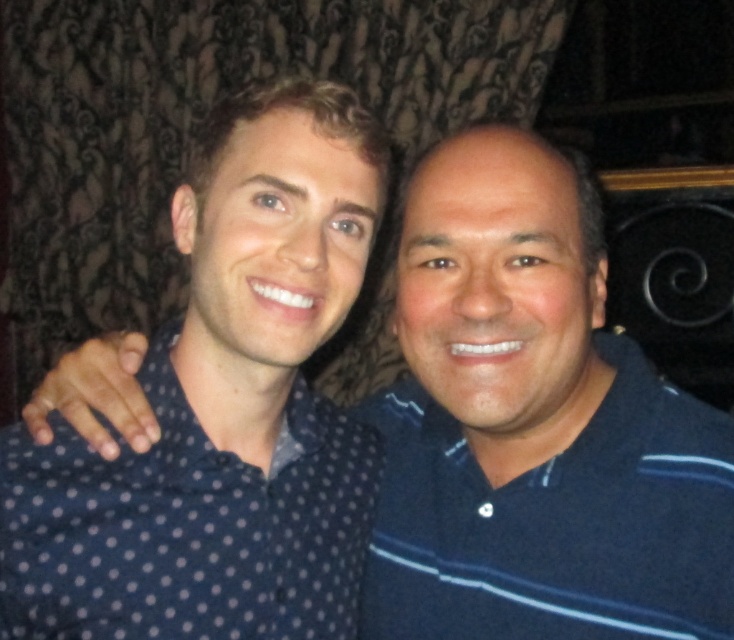
Which is in front, point (584, 524) or point (43, 458)?

Point (43, 458) is in front.

Based on the photo, is blue striped polo shirt at right smaller than dark blue polka dot shirt at left?

No.

Who is more distant from viewer, (723, 416) or (164, 444)?

The point (723, 416) is behind.

In order to click on blue striped polo shirt at right in this screenshot , I will do `click(555, 522)`.